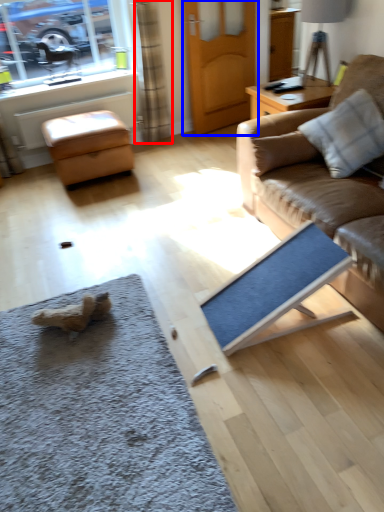
Question: Which object is further to the camera taking this photo, curtain (highlighted by a red box) or door (highlighted by a blue box)?

Choices:
 (A) curtain
 (B) door

Answer: (B)